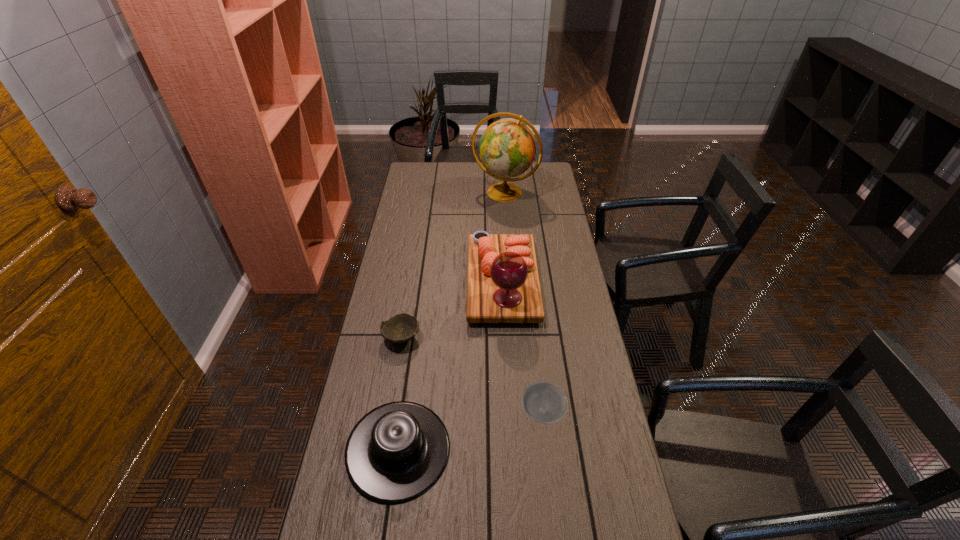
What are the coordinates of `the tallest object` in the screenshot? It's located at (507, 148).

You are a GUI agent. You are given a task and a screenshot of the screen. Output one action in this format:
    pyautogui.click(x=<x>, y=<y>)
    Task: Click on the farthest object
    The image size is (960, 540).
    Given the screenshot: What is the action you would take?
    pyautogui.click(x=507, y=148)

Locate an element on the screen. This screenshot has width=960, height=540. platter is located at coordinates (503, 286).

Locate an element on the screen. Image resolution: width=960 pixels, height=540 pixels. dress hat is located at coordinates (396, 452).

What are the coordinates of `the farther bowl` in the screenshot? It's located at point(402,327).

Where is `the nearer bowl`? the nearer bowl is located at coordinates pyautogui.click(x=543, y=402).

The height and width of the screenshot is (540, 960). Identify the location of vacant space positioned on the front of the globe. (509, 254).

I want to click on vacant space situated on the front of the platter, so click(x=511, y=428).

Identify the location of free space located 0.120m on the back of the third shortest object. Image resolution: width=960 pixels, height=540 pixels. (410, 370).

Image resolution: width=960 pixels, height=540 pixels. In order to click on free space located on the back of the left bowl in this screenshot , I will do `click(414, 264)`.